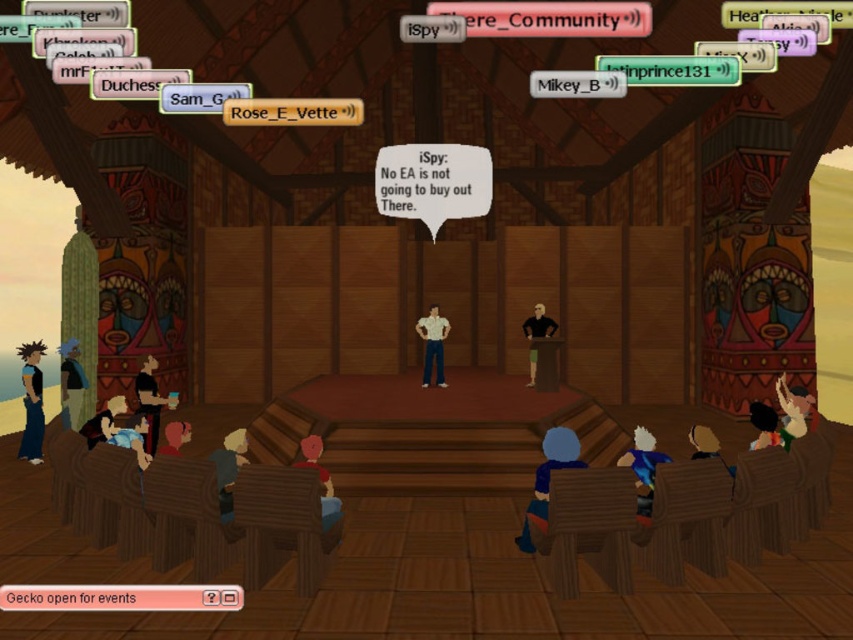
Question: Where is blue fabric shirt at left located in relation to black matte podium at center in the image?

Choices:
 (A) right
 (B) left

Answer: (B)

Question: Can you confirm if shiny blue hair at lower left is positioned to the right of matte pink hair at lower center?

Choices:
 (A) no
 (B) yes

Answer: (A)

Question: Which is farther from the red shirt at lower center?

Choices:
 (A) blue fabric shirt at lower right
 (B) blue fabric shirt at lower center
 (C) black matte podium at center

Answer: (C)

Question: Which of the following is the closest to the observer?

Choices:
 (A) (424, 362)
 (B) (224, 500)
 (C) (157, 404)

Answer: (B)

Question: Which of the following is the farthest from the observer?

Choices:
 (A) white matte shirt at center
 (B) matte black shirt at lower left
 (C) multicolored fabric at lower right
 (D) black matte podium at center

Answer: (A)

Question: Does shiny blue hair at lower left appear on the right side of green fabric shirt at lower right?

Choices:
 (A) no
 (B) yes

Answer: (A)